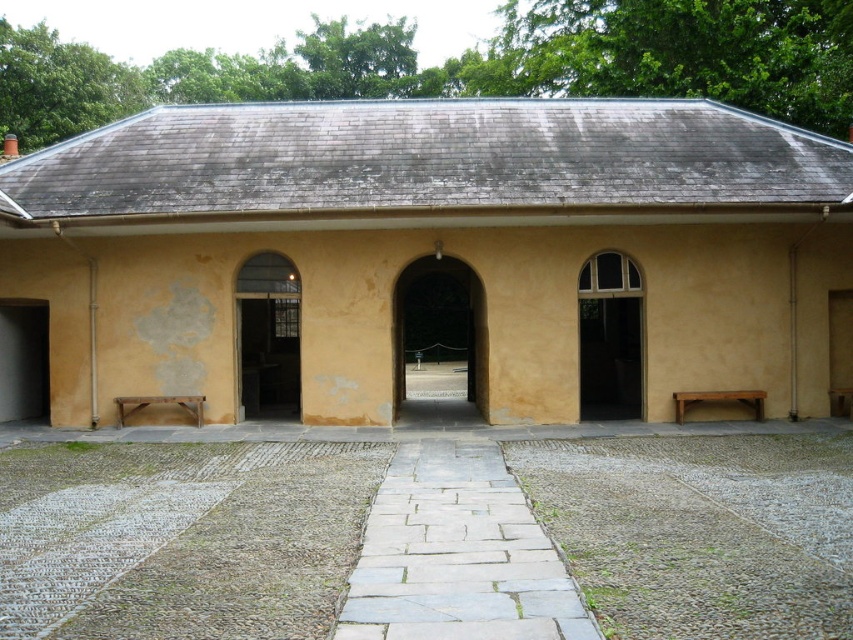
You are standing in the courtyard and want to enter the building through the doorway. Which object, the smooth stone archway at center or the matte glass door at center, should you pass under to enter?

The smooth stone archway at center is above the matte glass door at center, so you should pass under the smooth stone archway at center to enter the building.

You are standing in the courtyard and want to walk towards the central doorway. There are two points marked in the scene. Which point, point (630, 362) or point (448, 268), is closer to the central doorway?

Point (448, 268) is closer to the central doorway because it is in front of point (630, 362).